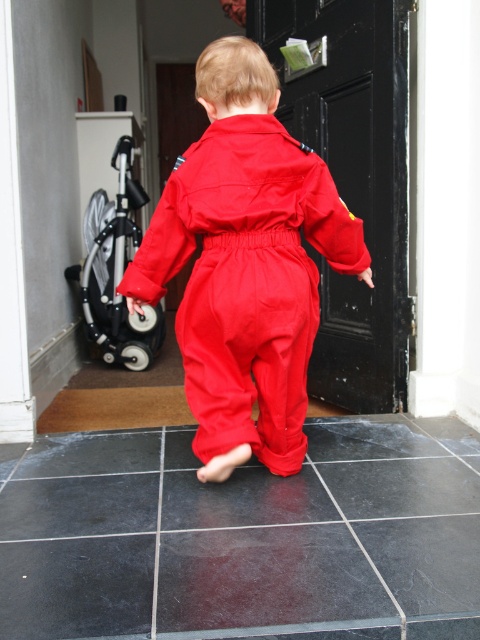
You are a parent trying to catch your child before they reach the black wooden door at center. Your child is wearing the matte red jumpsuit at center. If you can reach out 28 inches, will you be able to grab them before they reach the door?

The matte red jumpsuit at center and black wooden door at center are 28.43 inches apart. Since you can reach 28 inches, you will just barely miss grabbing them before they reach the door.

You are a parent holding a 1.5 meter long umbrella. You want to walk from the silver metallic stroller at left to the matte red jumpsuit at center to give the umbrella to the child. Can you do so without the umbrella hitting the stroller or the child?

The distance between the matte red jumpsuit at center and the silver metallic stroller at left is 1.75 meters. Since the umbrella is 1.5 meters long, you can walk between them without the umbrella hitting either, as there is enough space.

The child wearing the matte red jumpsuit at center wants to pass through the black wooden door at center. Can they fit through the doorway without turning sideways?

The matte red jumpsuit at center might be wider than black wooden door at center, so there is a possibility that the child may need to turn sideways to pass through the door.